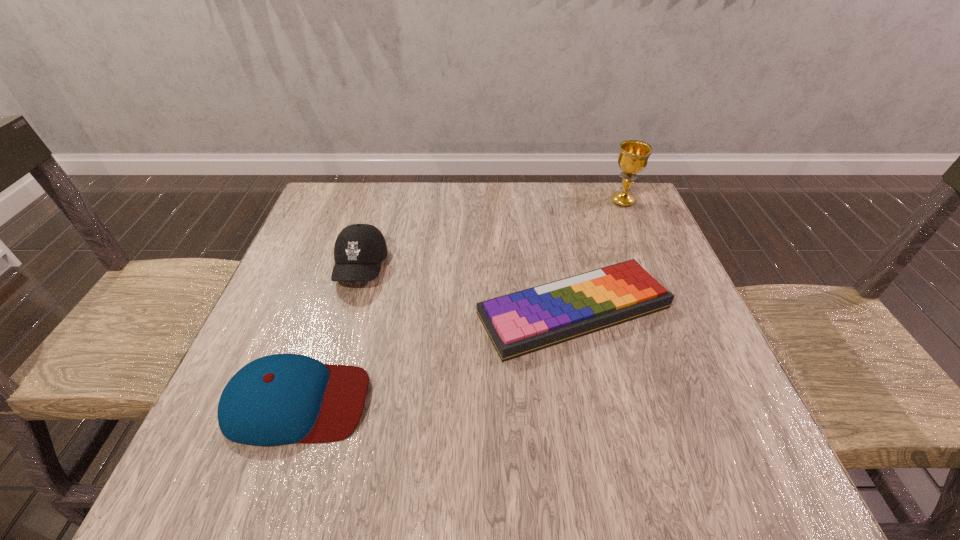
This screenshot has width=960, height=540. I want to click on vacant area located 0.120m on the back of the shortest object, so click(558, 237).

At what (x,y) coordinates should I click in order to perform the action: click on object at the far edge. Please return your answer as a coordinate pair (x, y). Looking at the image, I should click on (633, 156).

This screenshot has height=540, width=960. Find the location of `object that is positioned at the near edge`. object that is positioned at the near edge is located at coordinates (279, 399).

The height and width of the screenshot is (540, 960). In order to click on chalice that is at the right edge in this screenshot , I will do `click(633, 156)`.

You are a GUI agent. You are given a task and a screenshot of the screen. Output one action in this format:
    pyautogui.click(x=<x>, y=<y>)
    Task: Click on the computer keyboard present at the right edge
    Image resolution: width=960 pixels, height=540 pixels.
    Given the screenshot: What is the action you would take?
    pyautogui.click(x=520, y=323)

Find the location of a particular element. Image resolution: width=960 pixels, height=540 pixels. object that is at the near left corner is located at coordinates (279, 399).

The height and width of the screenshot is (540, 960). I want to click on object that is at the far right corner, so click(633, 156).

Find the location of a particular element. vacant space at the far edge is located at coordinates (545, 192).

Locate an element on the screen. vacant area at the near edge is located at coordinates (420, 451).

In the image, there is a desktop. Identify the location of blank space at the left edge. The image size is (960, 540). pyautogui.click(x=321, y=249).